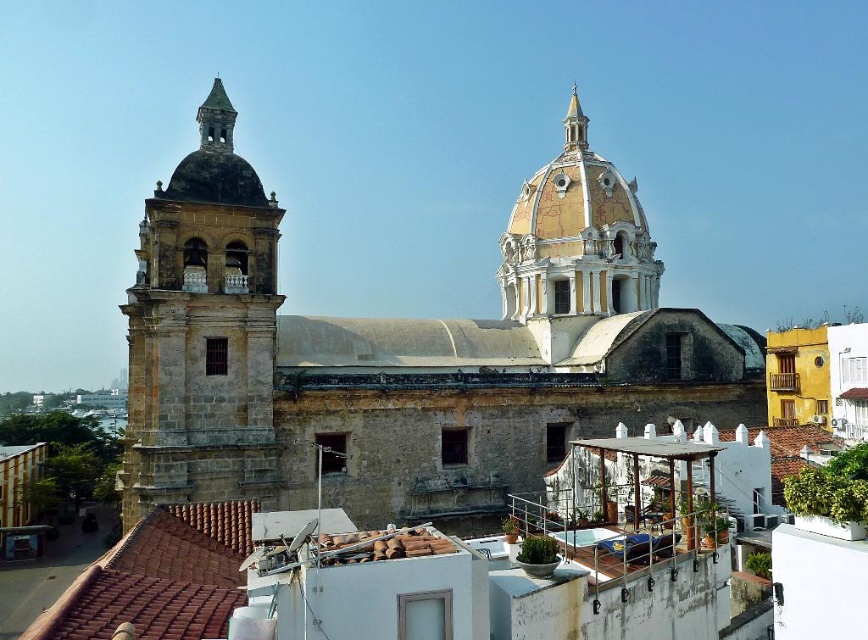
Question: Where is brown stone bell tower at left located in relation to yellowish marble dome at upper center in the image?

Choices:
 (A) right
 (B) left

Answer: (B)

Question: Observing the image, what is the correct spatial positioning of brown stone church at center in reference to yellowish marble dome at upper center?

Choices:
 (A) above
 (B) below

Answer: (B)

Question: Can you confirm if brown stone church at center is thinner than gold textured spire at upper center?

Choices:
 (A) no
 (B) yes

Answer: (A)

Question: Which point is farther from the camera taking this photo?

Choices:
 (A) (158, 406)
 (B) (579, 365)
 (C) (576, 109)

Answer: (C)

Question: Which object appears farthest from the camera in this image?

Choices:
 (A) yellowish marble dome at upper center
 (B) brown stone bell tower at left

Answer: (A)

Question: Which point is closer to the camera?

Choices:
 (A) yellowish marble dome at upper center
 (B) brown stone church at center
 (C) brown stone bell tower at left
 (D) gold textured spire at upper center

Answer: (C)